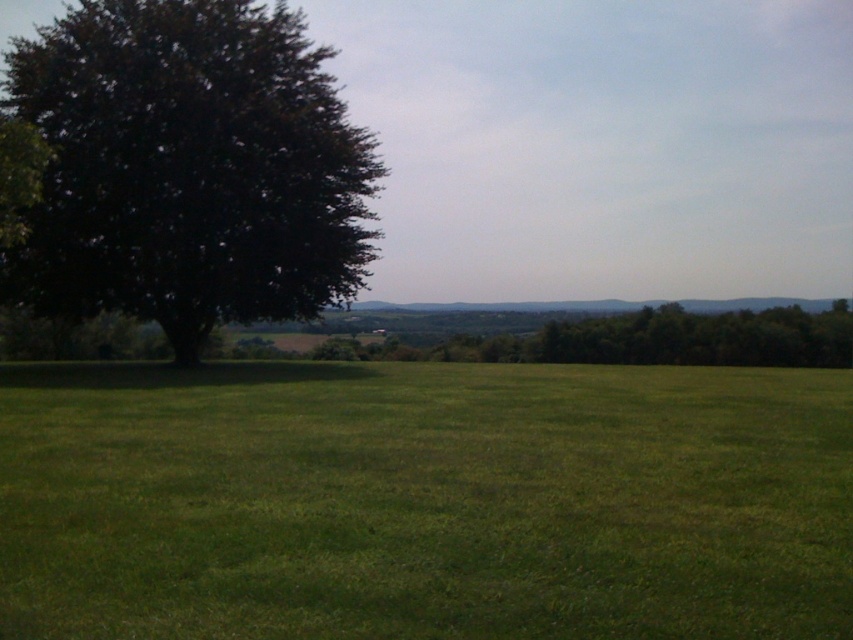
Does green grass at center have a greater width compared to dark green leafy tree at left?

No.

Is point (106, 611) less distant than point (367, 273)?

Yes, point (106, 611) is in front of point (367, 273).

Identify the location of green grass at center. (424, 500).